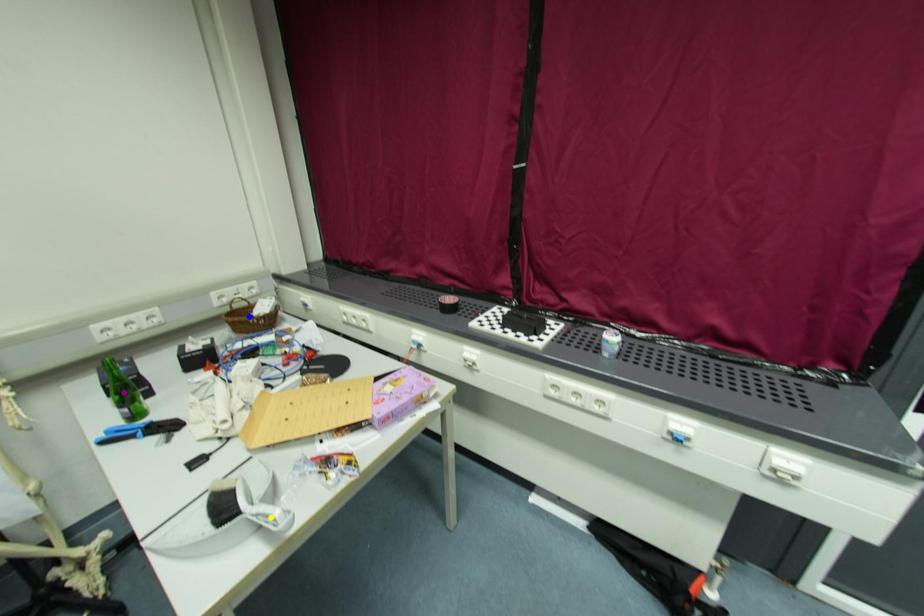
Order these from nearest to farthest:
A) purple point
B) blue point
C) yellow point

1. yellow point
2. purple point
3. blue point